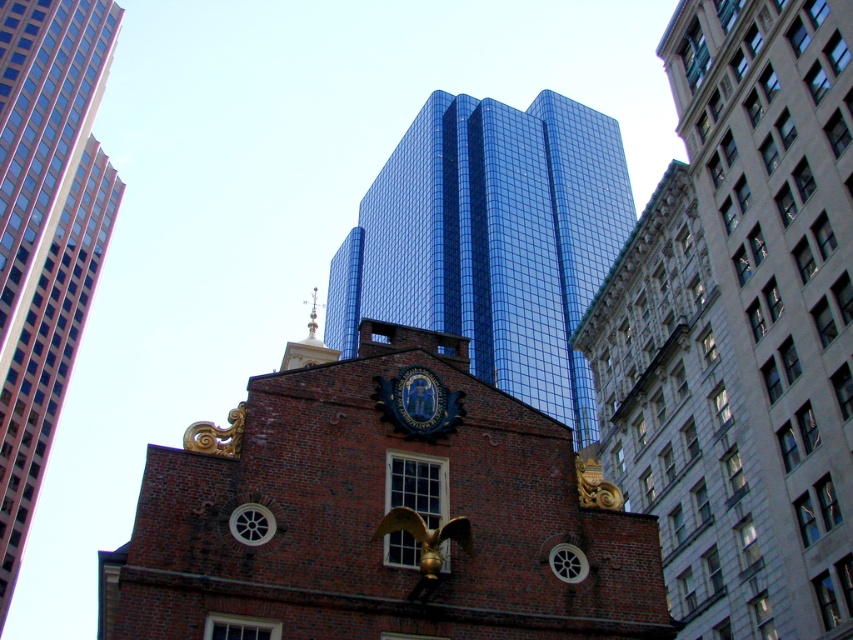
Who is shorter, brick bell tower at center or blue glossy seal at center?

With less height is blue glossy seal at center.

Between brick bell tower at center and blue glossy seal at center, which one is positioned lower?

blue glossy seal at center is below.

This screenshot has width=853, height=640. Describe the element at coordinates (45, 230) in the screenshot. I see `brick bell tower at center` at that location.

Where is `brick bell tower at center`? brick bell tower at center is located at coordinates (45, 230).

Can you confirm if glossy glass tower at center is thinner than blue glossy seal at center?

No, glossy glass tower at center is not thinner than blue glossy seal at center.

Is point (476, 232) more distant than point (407, 380)?

Yes, point (476, 232) is farther from viewer.

Identify the location of glossy glass tower at center. This screenshot has width=853, height=640. (492, 241).

Where is `glossy glass tower at center`? glossy glass tower at center is located at coordinates (492, 241).

Who is higher up, glossy glass tower at center or brick bell tower at center?

glossy glass tower at center is above.

Is glossy glass tower at center shorter than brick bell tower at center?

Yes.

Who is more distant from viewer, [523,173] or [18,13]?

The point [523,173] is behind.

Find the location of a particular element. glossy glass tower at center is located at coordinates (492, 241).